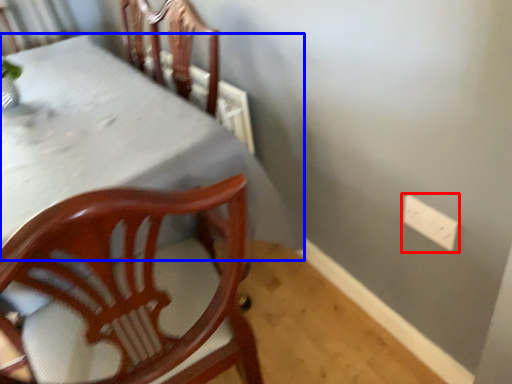
Question: Which object appears closest to the camera in this image, electric outlet (highlighted by a red box) or table (highlighted by a blue box)?

Choices:
 (A) electric outlet
 (B) table

Answer: (B)